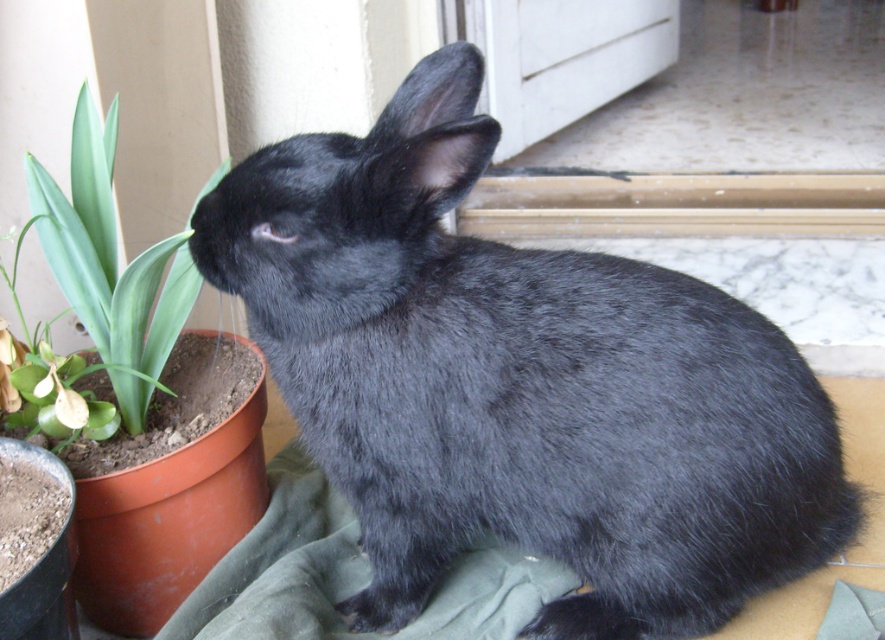
You are standing in the room where the black rabbit is sitting. You see two points marked in the image. The first point is at coordinates point (x=79, y=230) and the second point is at point (x=535, y=134). Which point is closer to you?

Point (x=79, y=230) is in front of point (x=535, y=134), so the first point is closer to you.

What is the exact coordinate position of the black fur rabbit at center in the image?

The black fur rabbit at center is located at point (519, 384).

You are a photographer trying to capture the black fur rabbit at center and the green leafy plant at lower left in a single frame. Given that the rabbit is larger than the plant, which object should you focus on first to ensure both are in focus?

The black fur rabbit at center has a larger size compared to the green leafy plant at lower left, so you should focus on the larger black fur rabbit at center first to ensure both are in focus.